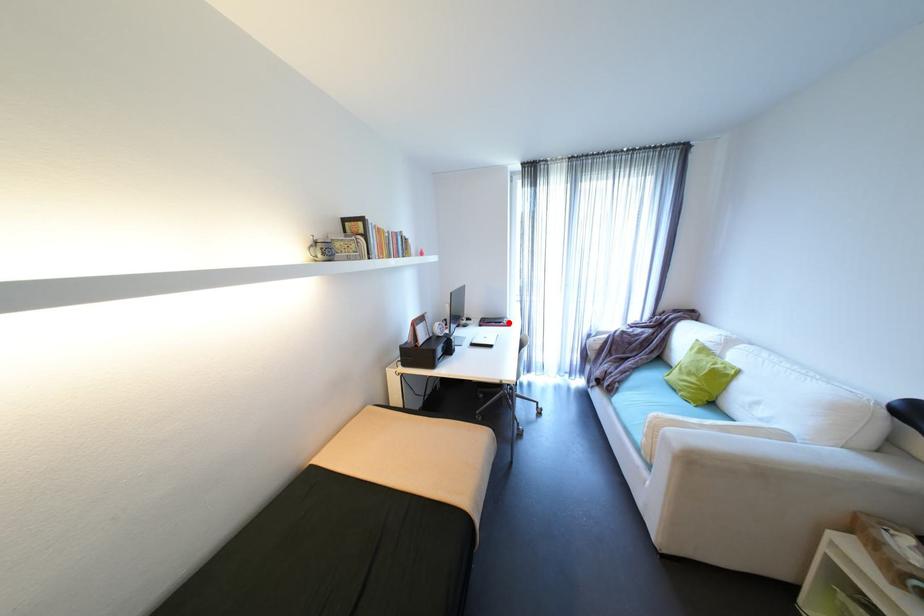
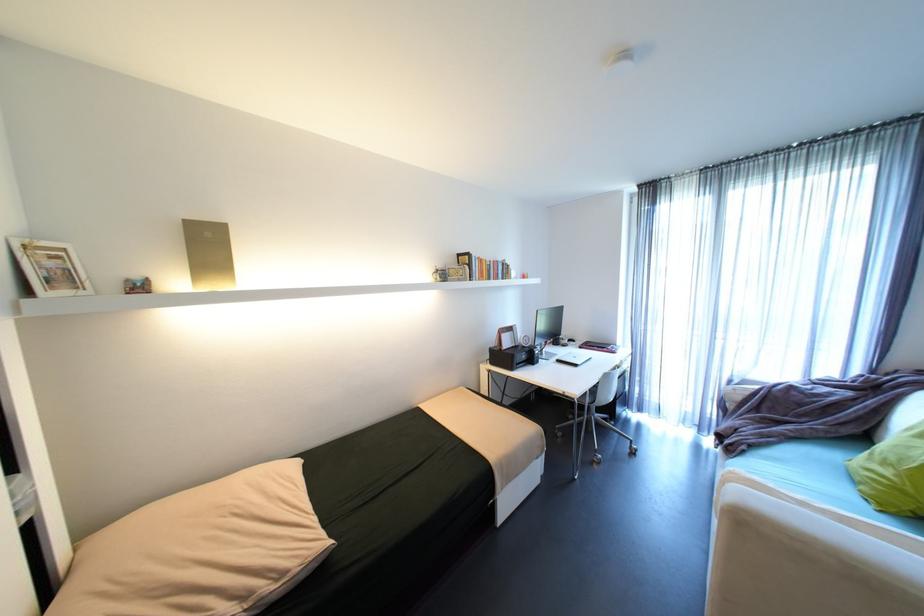
Find the pixel in the second image that matches the highlighted location in the first image.

(612, 347)